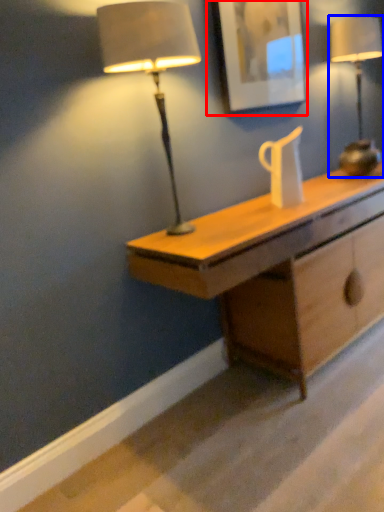
Question: Which point is closer to the camera, picture frame (highlighted by a red box) or lamp (highlighted by a blue box)?

Choices:
 (A) picture frame
 (B) lamp

Answer: (A)